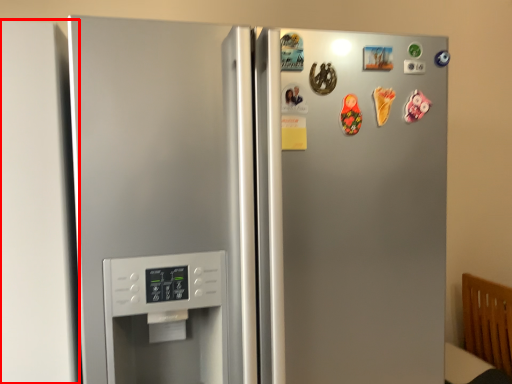
Question: In this image, where is door (annotated by the red box) located relative to refrigerator?

Choices:
 (A) left
 (B) right

Answer: (A)